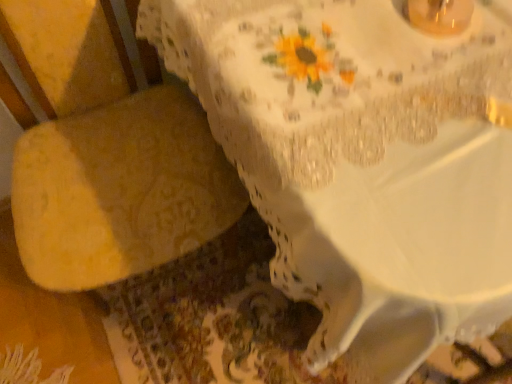
Question: Visually, is yellow fabric armchair at left positioned to the left or to the right of white lace tablecloth at upper center?

Choices:
 (A) right
 (B) left

Answer: (B)

Question: Is yellow fabric armchair at left situated inside white lace tablecloth at upper center or outside?

Choices:
 (A) inside
 (B) outside

Answer: (B)

Question: In terms of height, does yellow fabric armchair at left look taller or shorter compared to white lace tablecloth at upper center?

Choices:
 (A) short
 (B) tall

Answer: (B)

Question: Is white lace tablecloth at upper center bigger or smaller than yellow fabric armchair at left?

Choices:
 (A) small
 (B) big

Answer: (B)

Question: Considering the positions of point (289, 44) and point (148, 258), is point (289, 44) closer or farther from the camera than point (148, 258)?

Choices:
 (A) closer
 (B) farther

Answer: (A)

Question: Looking at their shapes, would you say white lace tablecloth at upper center is wider or thinner than yellow fabric armchair at left?

Choices:
 (A) thin
 (B) wide

Answer: (B)

Question: Is white lace tablecloth at upper center inside the boundaries of yellow fabric armchair at left, or outside?

Choices:
 (A) outside
 (B) inside

Answer: (A)